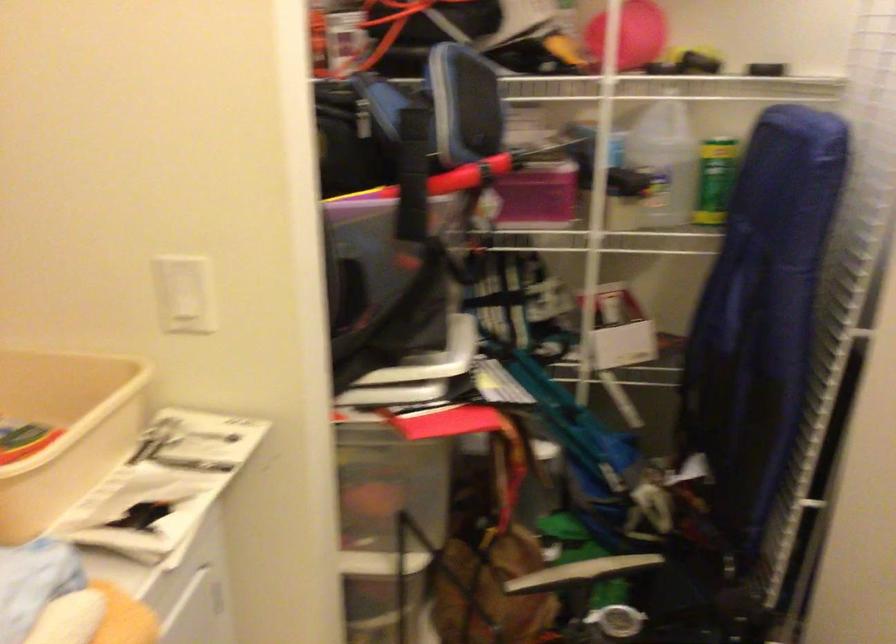
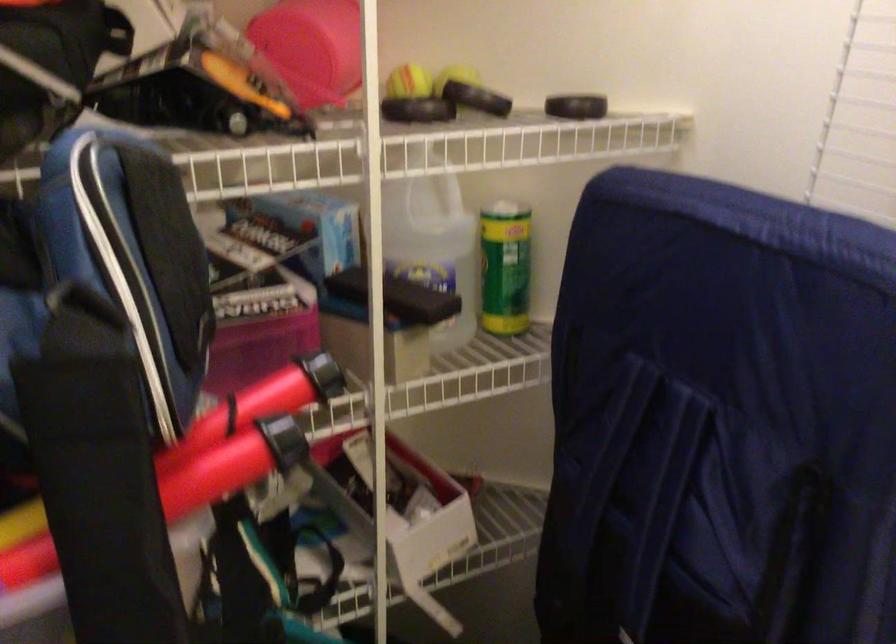
Where in the second image is the point corresponding to (x=708, y=176) from the first image?

(504, 267)